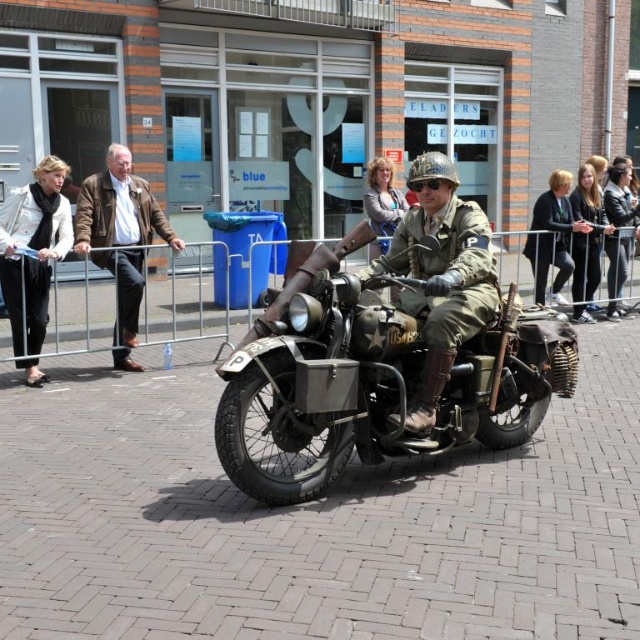
Looking at this image, between camouflage fabric jacket at center and green military uniform at center, which one is positioned higher?

green military uniform at center is above.

How distant is camouflage fabric jacket at center from green military uniform at center?

camouflage fabric jacket at center and green military uniform at center are 5.36 meters apart from each other.

Who is more distant from viewer, (433,349) or (554,184)?

The point (554,184) is more distant.

Locate an element on the screen. This screenshot has width=640, height=640. camouflage fabric jacket at center is located at coordinates (442, 275).

Who is positioned more to the right, brown leather jacket at left or white leather jacket at left?

brown leather jacket at left is more to the right.

Who is positioned more to the left, brown leather jacket at left or white leather jacket at left?

From the viewer's perspective, white leather jacket at left appears more on the left side.

What do you see at coordinates (120, 237) in the screenshot? The height and width of the screenshot is (640, 640). I see `brown leather jacket at left` at bounding box center [120, 237].

Where is `brown leather jacket at left`? This screenshot has width=640, height=640. brown leather jacket at left is located at coordinates (120, 237).

Who is positioned more to the left, brown leather jacket at left or green military uniform at center?

brown leather jacket at left is more to the left.

Who is more distant from viewer, (132, 193) or (563, 209)?

Positioned behind is point (563, 209).

Where is `brown leather jacket at left`? The width and height of the screenshot is (640, 640). brown leather jacket at left is located at coordinates (120, 237).